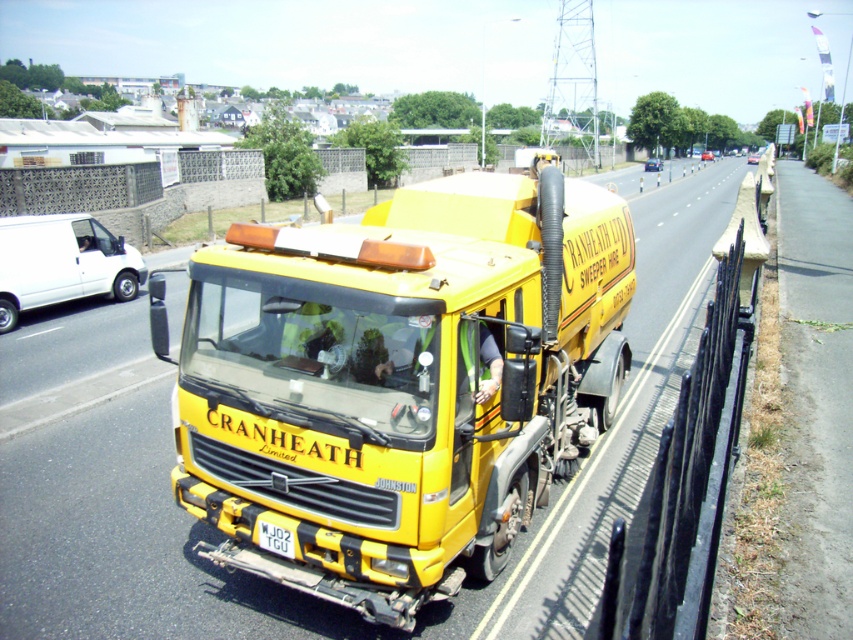
You are a delivery driver who needs to park your car behind the yellow matte truck at center so that it doesn not block the white plastic license plate at center. Based on their positions, which side of the truck should you park on?

The yellow matte truck at center is to the right of the white plastic license plate at center, so you should park on the left side of the yellow matte truck at center to avoid blocking the white plastic license plate at center.

You are a mechanic working on a yellow matte truck at center. You need to reach the white plastic license plate at center to clean it. Can you safely reach it from where you are standing on the truck?

The distance between the yellow matte truck at center and the white plastic license plate at center is 4.15 feet, so you can safely reach it from your current position on the truck.

You are a delivery driver who needs to deliver a package to the company that owns the yellow matte truck at center. The delivery address is written on the white plastic license plate at center. However, the license plate is partially obscured by the truck. Can you still read the license plate from your current position?

The yellow matte truck at center is closer to the viewer than the white plastic license plate at center, so the license plate is behind the truck and therefore obscured. You cannot read the license plate from your current position.